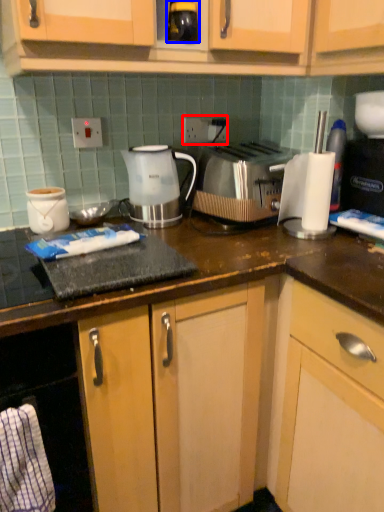
Question: Which object appears closest to the camera in this image, electric outlet (highlighted by a red box) or beverage (highlighted by a blue box)?

Choices:
 (A) electric outlet
 (B) beverage

Answer: (B)